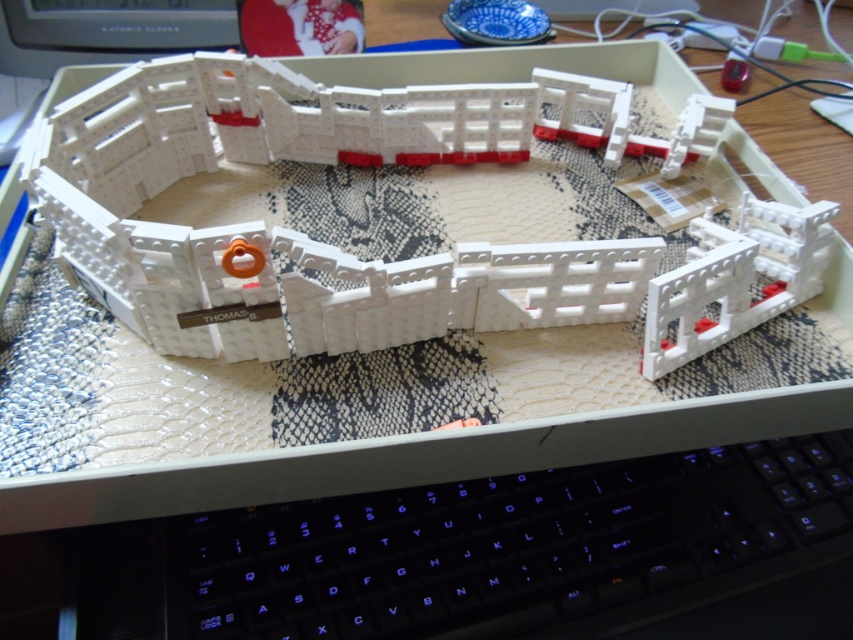
Can you confirm if black plastic keyboard at lower center is positioned above white plastic bridge at center-right?

Actually, black plastic keyboard at lower center is below white plastic bridge at center-right.

Does black plastic keyboard at lower center appear on the left side of white plastic bridge at center-right?

Correct, you'll find black plastic keyboard at lower center to the left of white plastic bridge at center-right.

Is point (242, 608) positioned before point (701, 216)?

Yes.

Image resolution: width=853 pixels, height=640 pixels. I want to click on black plastic keyboard at lower center, so click(x=538, y=554).

Between white plastic toy at center and white plastic bridge at center-right, which one appears on the left side from the viewer's perspective?

white plastic toy at center is more to the left.

Is point (459, 88) behind point (706, 252)?

Yes, it is.

Image resolution: width=853 pixels, height=640 pixels. What are the coordinates of `white plastic toy at center` in the screenshot? It's located at (265, 163).

Between point (219, 61) and point (538, 522), which one is positioned behind?

Point (219, 61)

Is white plastic toy at center thinner than black plastic keyboard at lower center?

Incorrect, white plastic toy at center's width is not less than black plastic keyboard at lower center's.

Who is more distant from viewer, (215, 92) or (610, 476)?

Point (215, 92)

Find the location of `white plastic toy at center`. white plastic toy at center is located at coordinates (265, 163).